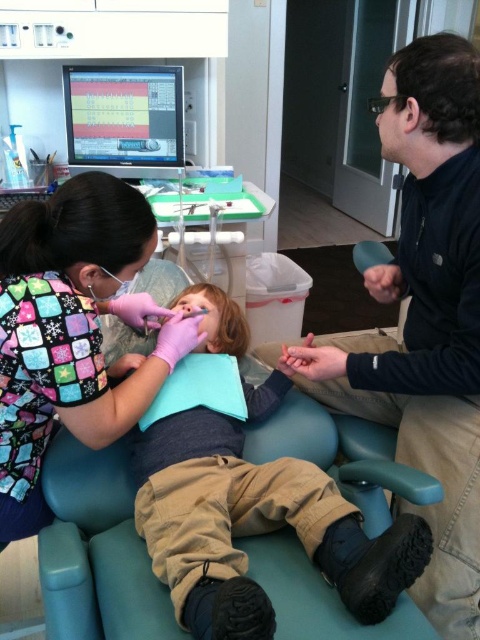
Question: Does matte black jacket at upper right appear over matte blue pillow at center?

Choices:
 (A) yes
 (B) no

Answer: (A)

Question: Which point appears closest to the camera in this image?

Choices:
 (A) (166, 128)
 (B) (126, 205)
 (C) (407, 124)

Answer: (B)

Question: Can you confirm if matte blue pillow at center is wider than matte plastic monitor at upper center?

Choices:
 (A) no
 (B) yes

Answer: (B)

Question: Which of the following is the farthest from the observer?

Choices:
 (A) (168, 156)
 (B) (456, 99)
 (C) (276, 515)

Answer: (A)

Question: Which object is farther from the camera taking this photo?

Choices:
 (A) matte blue pillow at center
 (B) matte plastic monitor at upper center
 (C) matte black jacket at upper right

Answer: (B)

Question: Is matte blue pillow at center thinner than multicolored scrubs at center?

Choices:
 (A) yes
 (B) no

Answer: (B)